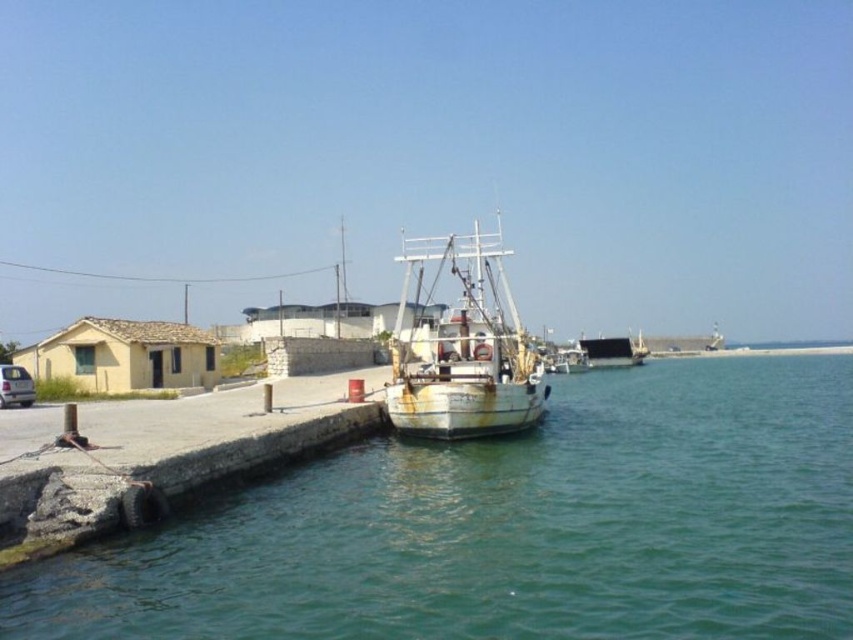
Question: Is green water at center to the right of rusty concrete dock at lower left from the viewer's perspective?

Choices:
 (A) no
 (B) yes

Answer: (B)

Question: Which of the following is the farthest from the observer?

Choices:
 (A) rusty concrete dock at lower left
 (B) rusty metal boat at center

Answer: (B)

Question: Which point appears closest to the camera in this image?

Choices:
 (A) (434, 472)
 (B) (524, 369)

Answer: (A)

Question: Observing the image, what is the correct spatial positioning of green water at center in reference to rusty metal boat at center?

Choices:
 (A) right
 (B) left

Answer: (A)

Question: Does green water at center lie behind rusty metal boat at center?

Choices:
 (A) no
 (B) yes

Answer: (A)

Question: Which point is closer to the camera taking this photo?

Choices:
 (A) (259, 433)
 (B) (479, 346)
 (C) (840, 545)

Answer: (C)